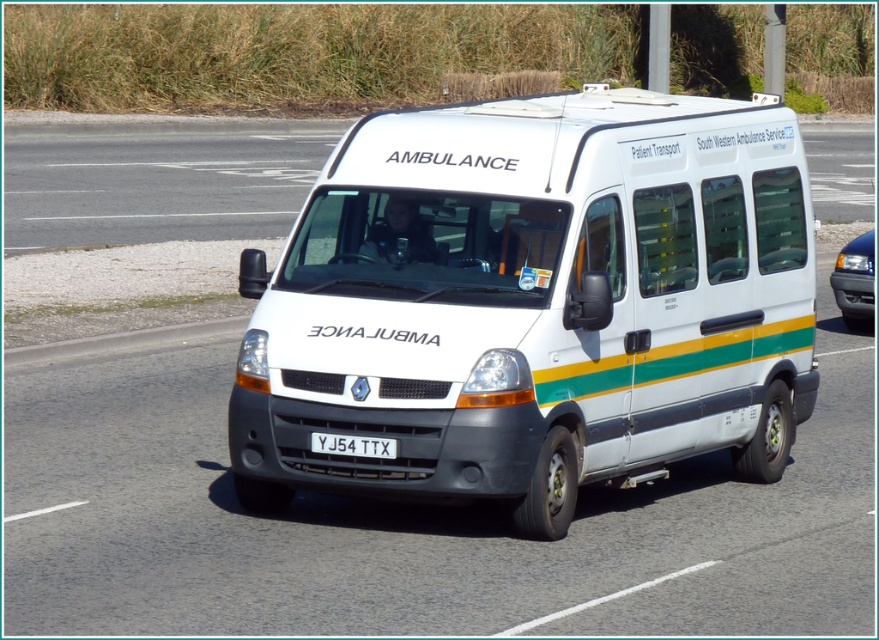
You are a driver who needs to identify the ambulance in the scene. Which object is larger between the white matte ambulance at center and the white plastic license plate at center?

The white matte ambulance at center is bigger than the white plastic license plate at center, so the ambulance is the larger object.

You are a traffic officer observing the scene. You notice a metallic blue car at right and a white plastic license plate at center. Which object is positioned higher in the image?

The metallic blue car at right is positioned higher than the white plastic license plate at center.

You are a pedestrian standing on the sidewalk and see the white matte ambulance at center and the metallic blue car at right. Which vehicle is positioned lower in the image?

The white matte ambulance at center is located below the metallic blue car at right, so it is positioned lower in the image.